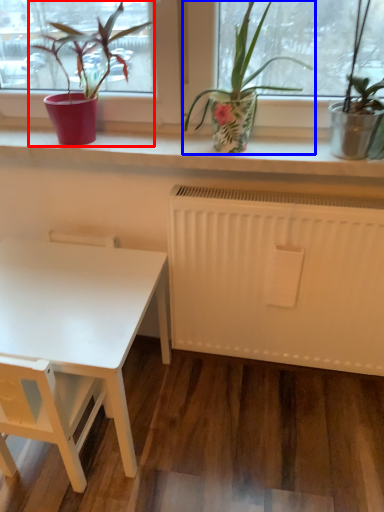
Question: Which point is closer to the camera, houseplant (highlighted by a red box) or houseplant (highlighted by a blue box)?

Choices:
 (A) houseplant
 (B) houseplant

Answer: (B)